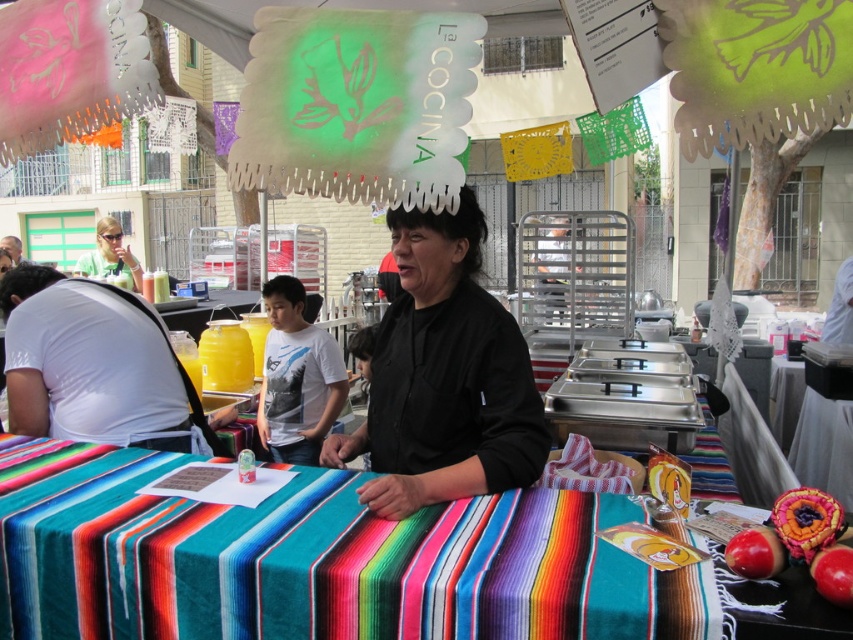
Is multicolored woven cloth at center behind black matte shirt at center?

No, it is not.

Is multicolored woven cloth at center shorter than black matte shirt at center?

Correct, multicolored woven cloth at center is not as tall as black matte shirt at center.

Image resolution: width=853 pixels, height=640 pixels. What are the coordinates of `multicolored woven cloth at center` in the screenshot? It's located at (314, 561).

Which is in front, point (86, 365) or point (111, 230)?

Point (86, 365)

Image resolution: width=853 pixels, height=640 pixels. What do you see at coordinates (93, 365) in the screenshot? I see `white matte shirt at left` at bounding box center [93, 365].

Between point (155, 387) and point (76, 272), which one is positioned in front?

Point (155, 387)

Locate an element on the screen. white matte shirt at left is located at coordinates (93, 365).

Can you confirm if black matte shirt at center is taller than red matte apple at lower right?

Correct, black matte shirt at center is much taller as red matte apple at lower right.

Who is positioned more to the left, black matte shirt at center or red matte apple at lower right?

black matte shirt at center

The width and height of the screenshot is (853, 640). What do you see at coordinates (444, 378) in the screenshot?
I see `black matte shirt at center` at bounding box center [444, 378].

Where is `black matte shirt at center`? black matte shirt at center is located at coordinates (444, 378).